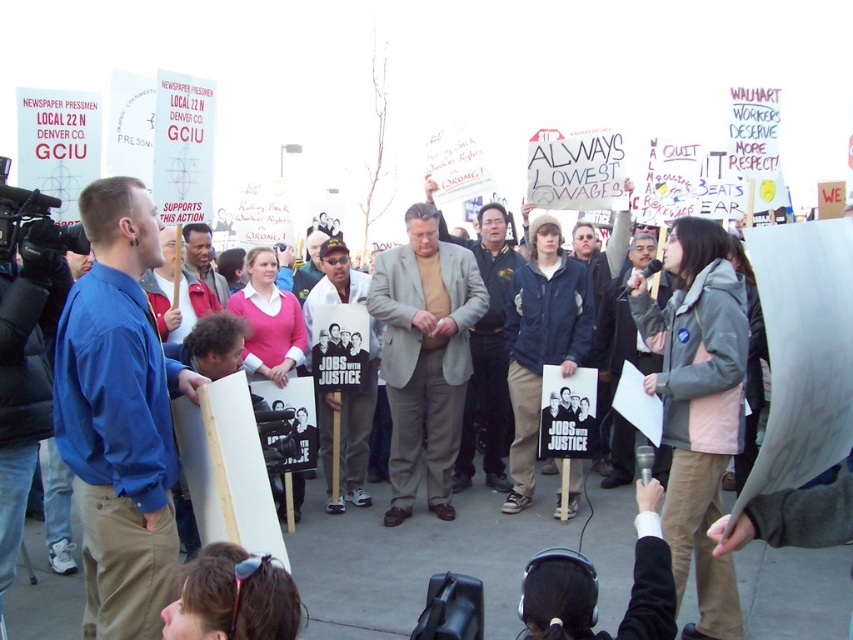
You are a photographer at the protest and want to capture both the light gray suit at center and the white cotton shirt at center in a single photo. Based on their positions, which one will appear higher in the photo?

The light gray suit at center will appear higher in the photo because it is located above the white cotton shirt at center.

You are a photographer standing in the crowd at the protest. You want to take a photo that includes both the point at [490,385] and the point at [375,356]. Which point should you focus on first to ensure both are in clear focus?

You should focus on the point at [375,356] first because it is closer to you than the point at [490,385]. By focusing on the closer point, the further point will also be within the depth of field and in focus.